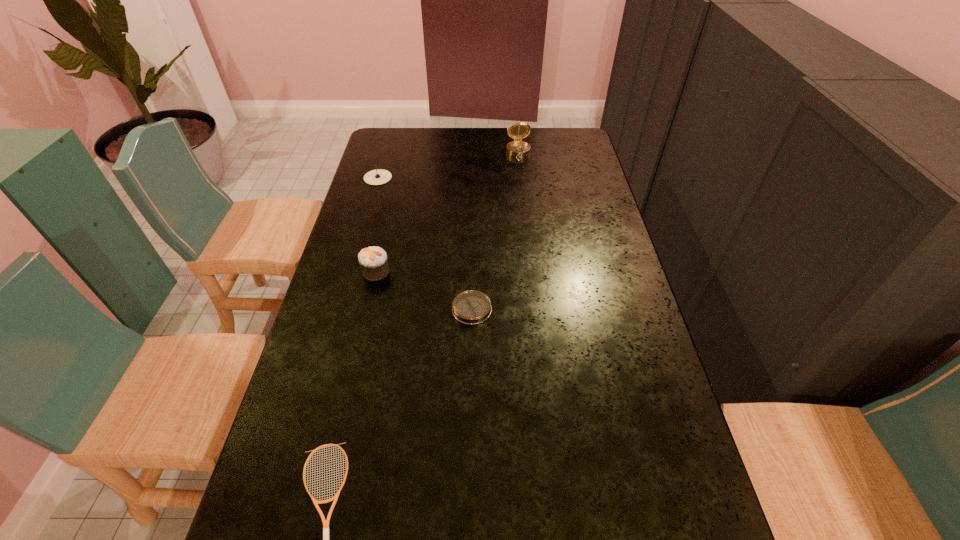
Locate an element on the screen. This screenshot has height=540, width=960. free area in between the cupcake and the tallest object is located at coordinates (447, 212).

This screenshot has width=960, height=540. In order to click on empty space that is in between the fourth nearest object and the third farthest object in this screenshot , I will do `click(377, 225)`.

What are the coordinates of `free spot between the second object from right to left and the second tallest object` in the screenshot? It's located at (423, 290).

Find the location of `unoccupied position between the tallest object and the second nearest object`. unoccupied position between the tallest object and the second nearest object is located at coordinates (495, 231).

At what (x,y) coordinates should I click in order to perform the action: click on vacant area that lies between the nearest compass and the third nearest object. Please return your answer as a coordinate pair (x, y). Image resolution: width=960 pixels, height=540 pixels. Looking at the image, I should click on (423, 290).

Locate which object ranks in proximity to the shortest object. Please provide its 2D coordinates. Your answer should be formatted as a tuple, i.e. [(x, y)], where the tuple contains the x and y coordinates of a point satisfying the conditions above.

[(471, 307)]

Where is `object that is the fourth closest to the tallest compass`? object that is the fourth closest to the tallest compass is located at coordinates (325, 522).

The height and width of the screenshot is (540, 960). Find the location of `compass that is the second closest to the leftmost compass`. compass that is the second closest to the leftmost compass is located at coordinates (471, 307).

Point out which compass is positioned as the second nearest to the third nearest object. Please provide its 2D coordinates. Your answer should be formatted as a tuple, i.e. [(x, y)], where the tuple contains the x and y coordinates of a point satisfying the conditions above.

[(379, 176)]